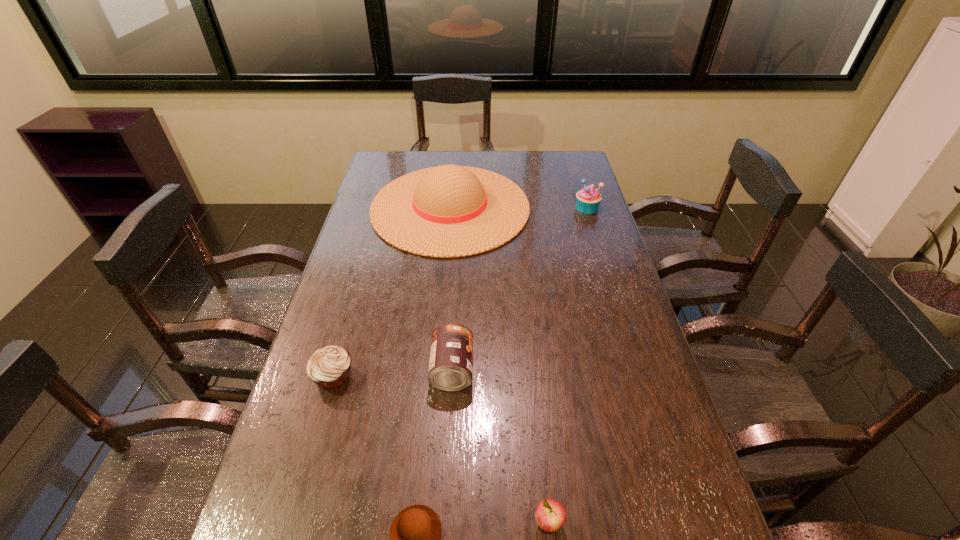
Image resolution: width=960 pixels, height=540 pixels. In order to click on muffin that can be found as the second closest to the tallest muffin in this screenshot , I will do `click(415, 535)`.

I want to click on free space that satisfies the following two spatial constraints: 1. on the front side of the rightmost muffin; 2. on the right side of the bonnet, so click(x=450, y=207).

Find the location of a particular element. vacant space that satisfies the following two spatial constraints: 1. on the front side of the bonnet; 2. on the right side of the apple is located at coordinates (423, 522).